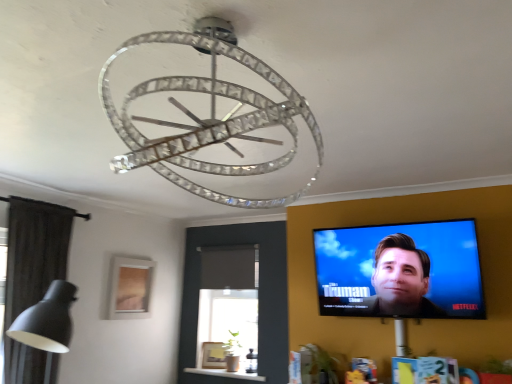
Question: Is matte black tv at upper right wider than matte wooden picture frame at lower left?

Choices:
 (A) yes
 (B) no

Answer: (A)

Question: Is matte black tv at upper right smaller than matte wooden picture frame at lower left?

Choices:
 (A) no
 (B) yes

Answer: (A)

Question: Is matte black tv at upper right positioned with its back to matte wooden picture frame at lower left?

Choices:
 (A) yes
 (B) no

Answer: (B)

Question: Is matte wooden picture frame at lower left located within matte black tv at upper right?

Choices:
 (A) yes
 (B) no

Answer: (B)

Question: From a real-world perspective, is matte black tv at upper right on matte wooden picture frame at lower left?

Choices:
 (A) yes
 (B) no

Answer: (A)

Question: Is clear crystal chandelier at center wider or thinner than matte black tv at upper right?

Choices:
 (A) thin
 (B) wide

Answer: (B)

Question: From their relative heights in the image, would you say clear crystal chandelier at center is taller or shorter than matte black tv at upper right?

Choices:
 (A) tall
 (B) short

Answer: (B)

Question: In the image, is clear crystal chandelier at center on the left side or the right side of matte black tv at upper right?

Choices:
 (A) left
 (B) right

Answer: (A)

Question: From a real-world perspective, is clear crystal chandelier at center physically located above or below matte black tv at upper right?

Choices:
 (A) above
 (B) below

Answer: (A)

Question: In terms of height, does matte wooden picture frame at lower left look taller or shorter compared to matte black tv at upper right?

Choices:
 (A) short
 (B) tall

Answer: (A)

Question: From the image's perspective, is matte wooden picture frame at lower left located above or below matte black tv at upper right?

Choices:
 (A) above
 (B) below

Answer: (B)

Question: From a real-world perspective, is matte wooden picture frame at lower left positioned above or below matte black tv at upper right?

Choices:
 (A) below
 (B) above

Answer: (A)

Question: Looking at their shapes, would you say matte wooden picture frame at lower left is wider or thinner than matte black tv at upper right?

Choices:
 (A) wide
 (B) thin

Answer: (B)

Question: Is point (x=461, y=307) positioned closer to the camera than point (x=197, y=26)?

Choices:
 (A) farther
 (B) closer

Answer: (A)

Question: Looking at the image, does matte black tv at upper right seem bigger or smaller compared to clear crystal chandelier at center?

Choices:
 (A) big
 (B) small

Answer: (A)